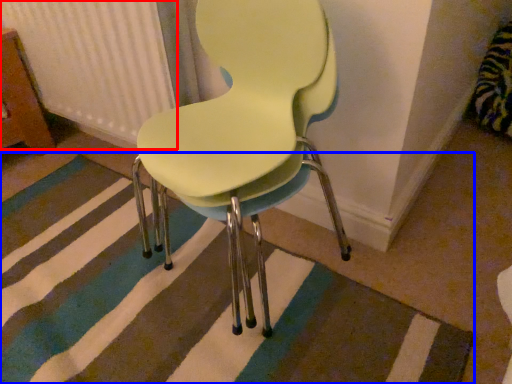
Question: Which of the following is the farthest to the observer, radiator (highlighted by a red box) or doormat (highlighted by a blue box)?

Choices:
 (A) radiator
 (B) doormat

Answer: (A)